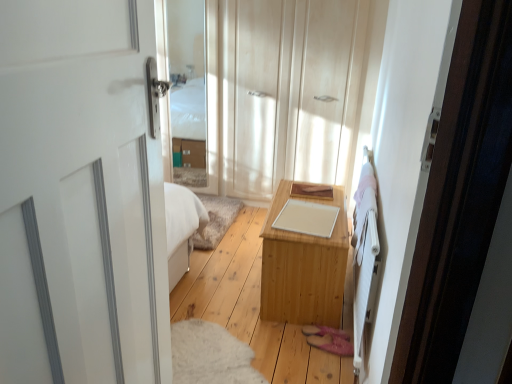
Question: Can you confirm if light wood dresser at center is smaller than light wood table at center?

Choices:
 (A) yes
 (B) no

Answer: (A)

Question: Can we say light wood dresser at center lies outside light wood table at center?

Choices:
 (A) yes
 (B) no

Answer: (A)

Question: Is light wood dresser at center to the left of light wood table at center from the viewer's perspective?

Choices:
 (A) yes
 (B) no

Answer: (A)

Question: Is there a large distance between light wood dresser at center and light wood table at center?

Choices:
 (A) yes
 (B) no

Answer: (A)

Question: Considering the relative sizes of light wood dresser at center and light wood table at center in the image provided, is light wood dresser at center thinner than light wood table at center?

Choices:
 (A) no
 (B) yes

Answer: (B)

Question: Can light wood table at center be found inside light wood dresser at center?

Choices:
 (A) no
 (B) yes

Answer: (A)

Question: Considering the relative sizes of white wooden bed frame at right and light wood dresser at center in the image provided, is white wooden bed frame at right taller than light wood dresser at center?

Choices:
 (A) yes
 (B) no

Answer: (B)

Question: Is light wood dresser at center at the back of white wooden bed frame at right?

Choices:
 (A) no
 (B) yes

Answer: (A)

Question: From the image's perspective, would you say white wooden bed frame at right is shown under light wood dresser at center?

Choices:
 (A) yes
 (B) no

Answer: (A)

Question: From a real-world perspective, does white wooden bed frame at right stand above light wood dresser at center?

Choices:
 (A) no
 (B) yes

Answer: (A)

Question: Does white wooden bed frame at right come in front of light wood dresser at center?

Choices:
 (A) yes
 (B) no

Answer: (A)

Question: Does white wooden bed frame at right appear on the right side of light wood dresser at center?

Choices:
 (A) no
 (B) yes

Answer: (B)

Question: Is white wooden bed frame at right next to clear glass mirror at upper center?

Choices:
 (A) no
 (B) yes

Answer: (A)